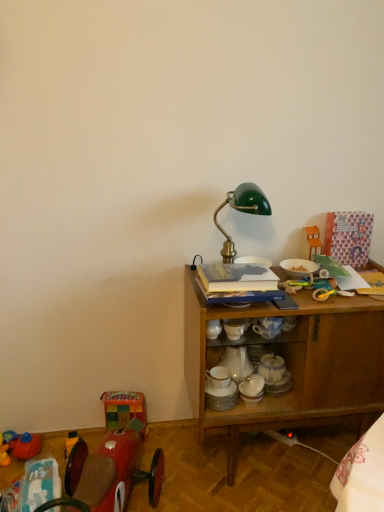
Locate an element on the screen. The width and height of the screenshot is (384, 512). rubber duck at lower left, which appears as the first toy when ordered from the bottom is located at coordinates (6, 447).

The image size is (384, 512). Describe the element at coordinates (243, 212) in the screenshot. I see `green glass table lamp at center` at that location.

Where is `green glass table lamp at center`? The width and height of the screenshot is (384, 512). green glass table lamp at center is located at coordinates [243, 212].

This screenshot has width=384, height=512. Find the location of `multicolored fabric cube at lower left, the second toy when ordered from top to bottom`. multicolored fabric cube at lower left, the second toy when ordered from top to bottom is located at coordinates (124, 409).

What do you see at coordinates (237, 277) in the screenshot?
I see `hardcover book at center` at bounding box center [237, 277].

In order to click on rubber duck at lower left, arranged as the 4th toy when viewed from the right in this screenshot , I will do `click(6, 447)`.

Is wooden cabinet at right oriented away from orange plastic toy house at upper right, marked as the first toy in a right-to-left arrangement?

No, wooden cabinet at right's orientation is not away from orange plastic toy house at upper right, marked as the first toy in a right-to-left arrangement.

From the image's perspective, which is above, wooden cabinet at right or orange plastic toy house at upper right, the 1th toy positioned from the top?

orange plastic toy house at upper right, the 1th toy positioned from the top, appears higher in the image.

Does wooden cabinet at right have a greater height compared to orange plastic toy house at upper right, the 4th toy from the left?

Indeed, wooden cabinet at right has a greater height compared to orange plastic toy house at upper right, the 4th toy from the left.

Is wooden cabinet at right with orange plastic toy house at upper right, the 4th toy from the left?

wooden cabinet at right and orange plastic toy house at upper right, the 4th toy from the left, are not in contact.

Find the location of a particular element. This screenshot has width=384, height=512. book above the rubber duck at lower left, the fourth toy positioned from the top (from a real-world perspective) is located at coordinates (237, 277).

Is hardcover book at center beside rubber duck at lower left, the fourth toy positioned from the top?

No, hardcover book at center is not with rubber duck at lower left, the fourth toy positioned from the top.

From the image's perspective, is hardcover book at center above or below rubber duck at lower left, arranged as the 4th toy when viewed from the right?

Based on their image positions, hardcover book at center is located above rubber duck at lower left, arranged as the 4th toy when viewed from the right.

Consider the image. Who is taller, hardcover book at center or rubber duck at lower left, arranged as the first toy when viewed from the left?

rubber duck at lower left, arranged as the first toy when viewed from the left, is taller.

Is multicolored fabric cube at lower left, the second toy viewed from the right, positioned beyond the bounds of shiny red car at lower left, which is the second toy in bottom-to-top order?

Absolutely, multicolored fabric cube at lower left, the second toy viewed from the right, is external to shiny red car at lower left, which is the second toy in bottom-to-top order.

Which is closer, (143, 407) or (132, 429)?

Clearly, point (143, 407) is more distant from the camera than point (132, 429).

Is the depth of multicolored fabric cube at lower left, the second toy viewed from the right, greater than that of shiny red car at lower left, which is counted as the 3th toy, starting from the top?

Yes, multicolored fabric cube at lower left, the second toy viewed from the right, is further from the camera.

Can you tell me how much multicolored fabric cube at lower left, the second toy when ordered from top to bottom, and shiny red car at lower left, which is counted as the 3th toy, starting from the top, differ in facing direction?

There is a 1.34-degree angle between the facing directions of multicolored fabric cube at lower left, the second toy when ordered from top to bottom, and shiny red car at lower left, which is counted as the 3th toy, starting from the top.

Is the depth of green glass table lamp at center greater than that of wooden cabinet at right?

Yes, green glass table lamp at center is further from the viewer.

Can you confirm if green glass table lamp at center is smaller than wooden cabinet at right?

Indeed, green glass table lamp at center has a smaller size compared to wooden cabinet at right.

From a real-world perspective, who is located lower, green glass table lamp at center or wooden cabinet at right?

From a 3D spatial view, wooden cabinet at right is below.

How many degrees apart are the facing directions of green glass table lamp at center and wooden cabinet at right?

There is a 0.00035-degree angle between the facing directions of green glass table lamp at center and wooden cabinet at right.

In terms of size, does rubber duck at lower left, arranged as the 4th toy when viewed from the right, appear bigger or smaller than multicolored fabric cube at lower left, the second toy when ordered from top to bottom?

Clearly, rubber duck at lower left, arranged as the 4th toy when viewed from the right, is smaller in size than multicolored fabric cube at lower left, the second toy when ordered from top to bottom.

In the image, is rubber duck at lower left, arranged as the first toy when viewed from the left, on the left side or the right side of multicolored fabric cube at lower left, the second toy viewed from the right?

Clearly, rubber duck at lower left, arranged as the first toy when viewed from the left, is on the left of multicolored fabric cube at lower left, the second toy viewed from the right, in the image.

Are rubber duck at lower left, arranged as the first toy when viewed from the left, and multicolored fabric cube at lower left, placed as the third toy when sorted from left to right, far apart?

No, there isn't a large distance between rubber duck at lower left, arranged as the first toy when viewed from the left, and multicolored fabric cube at lower left, placed as the third toy when sorted from left to right.

From the image's perspective, is orange plastic toy house at upper right, the 4th toy from the left, beneath green glass table lamp at center?

Indeed, from the image's perspective, orange plastic toy house at upper right, the 4th toy from the left, is shown beneath green glass table lamp at center.

Could you measure the distance between orange plastic toy house at upper right, marked as the first toy in a right-to-left arrangement, and green glass table lamp at center?

13.17 inches.

Identify the location of table lamp located on the left of orange plastic toy house at upper right, the 1th toy positioned from the top. (243, 212).

Considering the positions of objects orange plastic toy house at upper right, the 4th toy from the left, and green glass table lamp at center in the image provided, who is more to the right, orange plastic toy house at upper right, the 4th toy from the left, or green glass table lamp at center?

orange plastic toy house at upper right, the 4th toy from the left.

Considering their positions, is shiny red car at lower left, which ranks as the second toy in left-to-right order, located in front of or behind green glass table lamp at center?

shiny red car at lower left, which ranks as the second toy in left-to-right order, is in front of green glass table lamp at center.

Considering the points (67, 465) and (264, 211), which point is behind, point (67, 465) or point (264, 211)?

The point (67, 465) is farther.

From a real-world perspective, between shiny red car at lower left, which is counted as the 3th toy, starting from the top, and green glass table lamp at center, who is vertically lower?

From a 3D spatial view, shiny red car at lower left, which is counted as the 3th toy, starting from the top, is below.

Can you see shiny red car at lower left, which is counted as the 3th toy, starting from the top, touching green glass table lamp at center?

They are not placed beside each other.

In order to click on toy on the right of wooden cabinet at right in this screenshot , I will do `click(310, 242)`.

Where is `the 3rd toy positioned below the hardcover book at center (from a real-world perspective)`? the 3rd toy positioned below the hardcover book at center (from a real-world perspective) is located at coordinates (6, 447).

Based on their spatial positions, is rubber duck at lower left, which appears as the first toy when ordered from the bottom, or green glass table lamp at center further from orange plastic toy house at upper right, positioned as the 4th toy in bottom-to-top order?

rubber duck at lower left, which appears as the first toy when ordered from the bottom, is further to orange plastic toy house at upper right, positioned as the 4th toy in bottom-to-top order.

From the image, which object appears to be farther from multicolored fabric cube at lower left, the second toy viewed from the right, wooden cabinet at right or orange plastic toy house at upper right, marked as the first toy in a right-to-left arrangement?

orange plastic toy house at upper right, marked as the first toy in a right-to-left arrangement, is positioned further to the anchor multicolored fabric cube at lower left, the second toy viewed from the right.

Considering their positions, is shiny red car at lower left, which is counted as the third toy, starting from the right, positioned further to green glass table lamp at center than hardcover book at center?

shiny red car at lower left, which is counted as the third toy, starting from the right, is positioned further to the anchor green glass table lamp at center.

Looking at the image, which one is located closer to shiny red car at lower left, which ranks as the second toy in left-to-right order, wooden cabinet at right or hardcover book at center?

Among the two, wooden cabinet at right is located nearer to shiny red car at lower left, which ranks as the second toy in left-to-right order.

When comparing their distances from shiny red car at lower left, which ranks as the second toy in left-to-right order, does orange plastic toy house at upper right, marked as the first toy in a right-to-left arrangement, or multicolored fabric cube at lower left, the second toy viewed from the right, seem further?

The object further to shiny red car at lower left, which ranks as the second toy in left-to-right order, is orange plastic toy house at upper right, marked as the first toy in a right-to-left arrangement.

Estimate the real-world distances between objects in this image. Which object is further from green glass table lamp at center, wooden cabinet at right or multicolored fabric cube at lower left, the second toy viewed from the right?

multicolored fabric cube at lower left, the second toy viewed from the right, lies further to green glass table lamp at center than the other object.

When comparing their distances from orange plastic toy house at upper right, the 4th toy from the left, does green glass table lamp at center or hardcover book at center seem closer?

green glass table lamp at center is closer to orange plastic toy house at upper right, the 4th toy from the left.

Estimate the real-world distances between objects in this image. Which object is further from orange plastic toy house at upper right, the 4th toy from the left, hardcover book at center or green glass table lamp at center?

hardcover book at center lies further to orange plastic toy house at upper right, the 4th toy from the left, than the other object.

Find the location of a particular element. This screenshot has height=512, width=384. book between shiny red car at lower left, which ranks as the second toy in left-to-right order, and wooden cabinet at right from left to right is located at coordinates (237, 277).

The height and width of the screenshot is (512, 384). I want to click on table lamp between hardcover book at center and orange plastic toy house at upper right, the 1th toy positioned from the top, from front to back, so click(243, 212).

In order to click on book between orange plastic toy house at upper right, marked as the first toy in a right-to-left arrangement, and wooden cabinet at right vertically in this screenshot , I will do `click(237, 277)`.

At what (x,y) coordinates should I click in order to perform the action: click on toy between hardcover book at center and shiny red car at lower left, which is counted as the third toy, starting from the right, in the up-down direction. Please return your answer as a coordinate pair (x, y). This screenshot has height=512, width=384. Looking at the image, I should click on (124, 409).